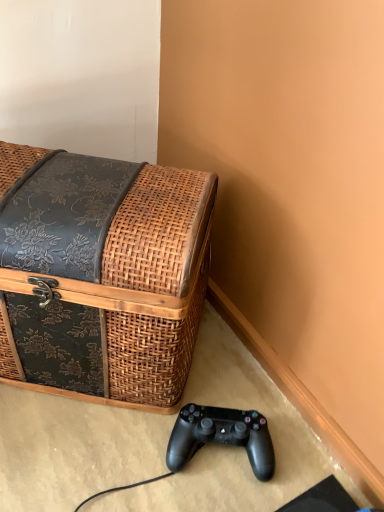
Question: In terms of size, does black matte game controller at lower center appear bigger or smaller than woven wood trunk at left?

Choices:
 (A) big
 (B) small

Answer: (B)

Question: From a real-world perspective, is black matte game controller at lower center positioned above or below woven wood trunk at left?

Choices:
 (A) above
 (B) below

Answer: (B)

Question: Considering the relative positions of black matte game controller at lower center and woven wood trunk at left in the image provided, is black matte game controller at lower center to the left or to the right of woven wood trunk at left?

Choices:
 (A) right
 (B) left

Answer: (A)

Question: In terms of width, does woven wood trunk at left look wider or thinner when compared to black matte game controller at lower center?

Choices:
 (A) wide
 (B) thin

Answer: (A)

Question: Is woven wood trunk at left to the left or to the right of black matte game controller at lower center in the image?

Choices:
 (A) right
 (B) left

Answer: (B)

Question: From a real-world perspective, is woven wood trunk at left physically located above or below black matte game controller at lower center?

Choices:
 (A) below
 (B) above

Answer: (B)

Question: From the image's perspective, is woven wood trunk at left positioned above or below black matte game controller at lower center?

Choices:
 (A) above
 (B) below

Answer: (A)